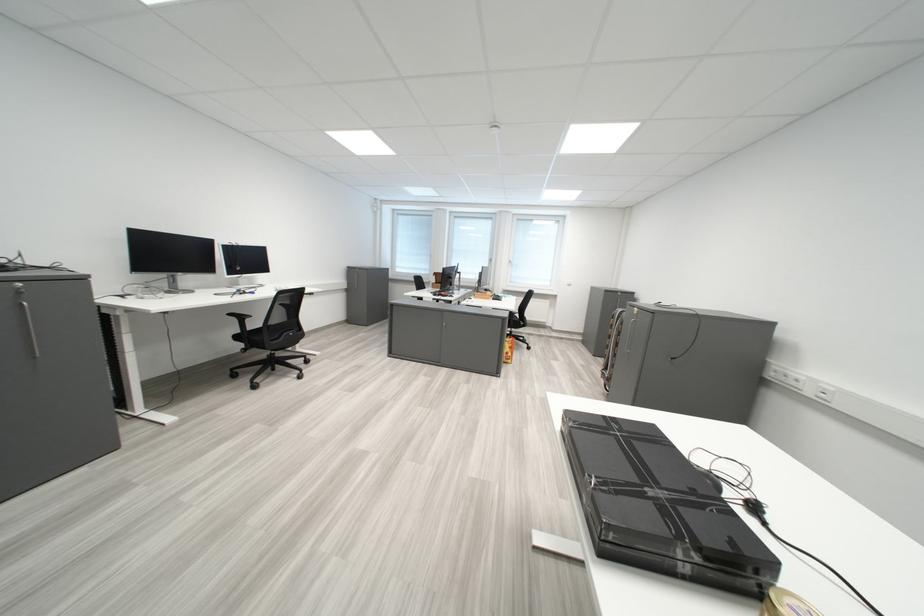
Find where to pull the silver cabinet handle. Please return your answer as a coordinate pair (x, y).

(30, 329)